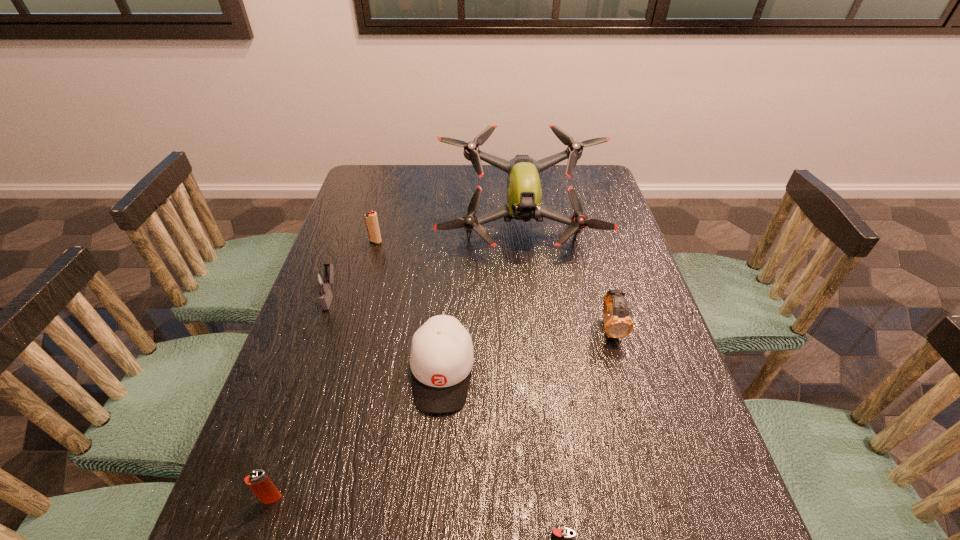
Where is `drone`? drone is located at coordinates (524, 193).

The image size is (960, 540). In order to click on the fifth nearest object in this screenshot , I will do `click(322, 281)`.

Identify the location of the farthest igniter. (371, 220).

Identify the location of the third igniter from left to right. (371, 220).

The image size is (960, 540). I want to click on baseball cap, so click(441, 358).

At what (x,y) coordinates should I click in order to perform the action: click on watch. Please return your answer as a coordinate pair (x, y). The height and width of the screenshot is (540, 960). Looking at the image, I should click on (618, 324).

Locate an element on the screen. The image size is (960, 540). the second nearest object is located at coordinates (258, 481).

Find the location of a particular element. free location located on the front-facing side of the drone is located at coordinates (526, 274).

Locate an element on the screen. This screenshot has height=540, width=960. vacant space located 0.360m on the front of the third nearest igniter is located at coordinates (x=278, y=447).

This screenshot has width=960, height=540. What are the coordinates of `free region located 0.350m on the right of the third object from left to right` in the screenshot? It's located at click(497, 241).